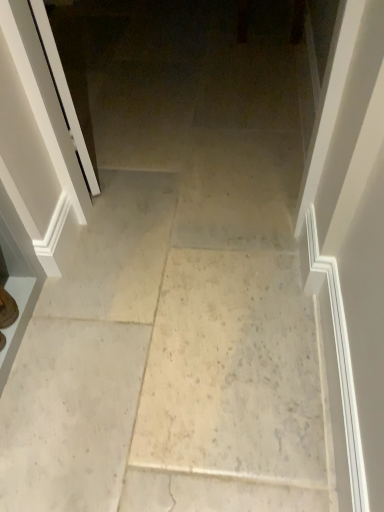
Question: Is white glossy screen door at left positioned behind white marble floor at center?

Choices:
 (A) no
 (B) yes

Answer: (B)

Question: Does white glossy screen door at left appear on the left side of white marble floor at center?

Choices:
 (A) no
 (B) yes

Answer: (B)

Question: Is the depth of white glossy screen door at left less than that of white marble floor at center?

Choices:
 (A) yes
 (B) no

Answer: (B)

Question: Is white glossy screen door at left oriented towards white marble floor at center?

Choices:
 (A) yes
 (B) no

Answer: (B)

Question: Can we say white glossy screen door at left lies outside white marble floor at center?

Choices:
 (A) no
 (B) yes

Answer: (B)

Question: From their relative heights in the image, would you say white glossy screen door at left is taller or shorter than matte brown shoe at lower left?

Choices:
 (A) short
 (B) tall

Answer: (B)

Question: Relative to matte brown shoe at lower left, is white glossy screen door at left in front or behind?

Choices:
 (A) front
 (B) behind

Answer: (A)

Question: Considering the positions of point (44, 268) and point (3, 326), is point (44, 268) closer or farther from the camera than point (3, 326)?

Choices:
 (A) farther
 (B) closer

Answer: (A)

Question: From the image's perspective, is white glossy screen door at left above or below matte brown shoe at lower left?

Choices:
 (A) below
 (B) above

Answer: (B)

Question: Relative to white glossy screen door at left, is white marble floor at center in front or behind?

Choices:
 (A) behind
 (B) front

Answer: (B)

Question: From a real-world perspective, is white marble floor at center physically located above or below white glossy screen door at left?

Choices:
 (A) above
 (B) below

Answer: (B)

Question: Is white marble floor at center to the left or to the right of white glossy screen door at left in the image?

Choices:
 (A) left
 (B) right

Answer: (B)

Question: Is white marble floor at center situated inside white glossy screen door at left or outside?

Choices:
 (A) inside
 (B) outside

Answer: (B)

Question: Is matte brown shoe at lower left to the left or to the right of white marble floor at center in the image?

Choices:
 (A) left
 (B) right

Answer: (A)

Question: Choose the correct answer: Is matte brown shoe at lower left inside white marble floor at center or outside it?

Choices:
 (A) outside
 (B) inside

Answer: (A)